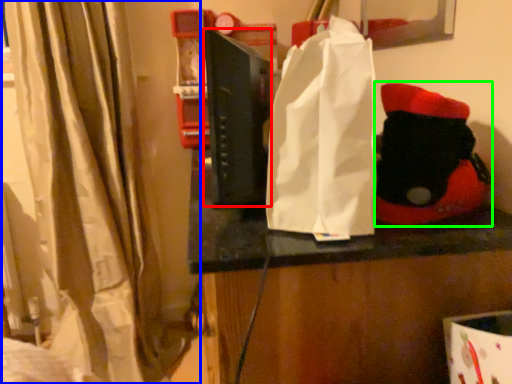
Question: Which object is positioned farthest from book (highlighted by a red box)? Select from curtain (highlighted by a blue box) and toy (highlighted by a green box).

Choices:
 (A) curtain
 (B) toy

Answer: (A)